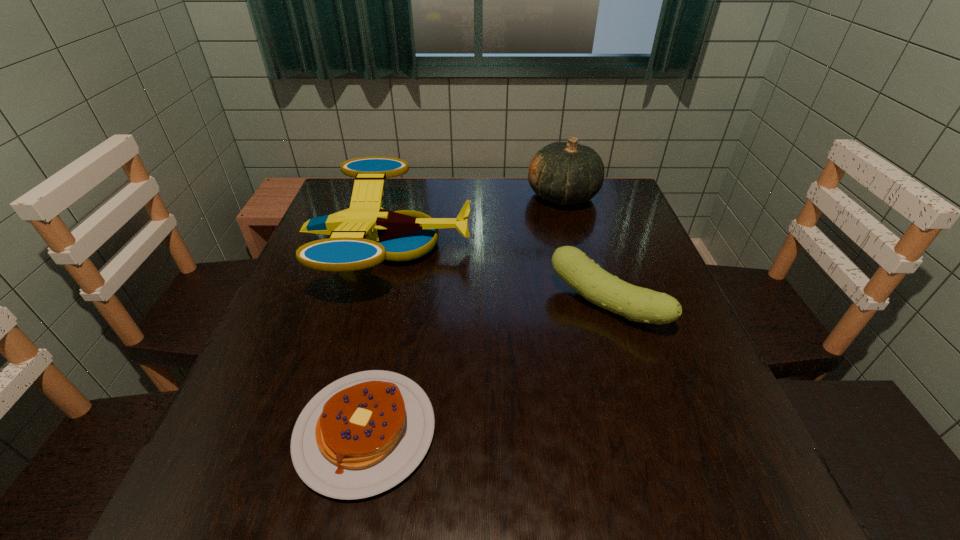
The width and height of the screenshot is (960, 540). I want to click on drone that is positioned at the far edge, so click(364, 235).

This screenshot has width=960, height=540. I want to click on object that is at the near edge, so click(361, 435).

This screenshot has width=960, height=540. Identify the location of drone positioned at the left edge. (364, 235).

Locate an element on the screen. This screenshot has width=960, height=540. pancake that is at the left edge is located at coordinates (361, 435).

Locate an element on the screen. The height and width of the screenshot is (540, 960). gourd located at the right edge is located at coordinates (566, 173).

Locate an element on the screen. This screenshot has width=960, height=540. cucumber situated at the right edge is located at coordinates (574, 267).

Identify the location of object situated at the far left corner. (364, 235).

Identify the location of object present at the near left corner. pyautogui.click(x=361, y=435).

Identify the location of object present at the far right corner. This screenshot has height=540, width=960. (566, 173).

Where is `vacant space at the far edge of the desktop`? The image size is (960, 540). vacant space at the far edge of the desktop is located at coordinates (530, 201).